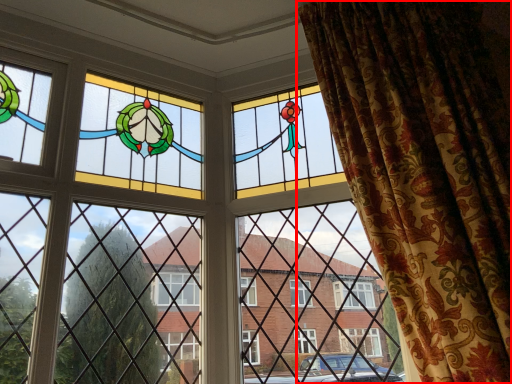
Question: In this image, where is curtain (annotated by the red box) located relative to window?

Choices:
 (A) left
 (B) right

Answer: (B)